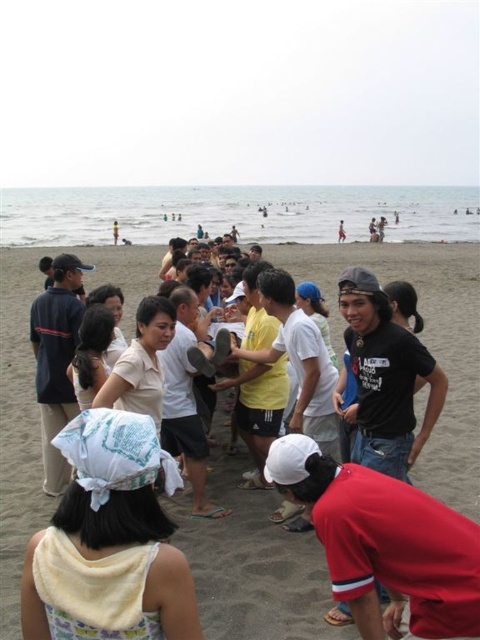
You are a photographer trying to capture a photo of the matte yellow towel at center without any obstructions. Given that the red matte baseball cap at lower center is in the scene, where should you position yourself relative to the towel to ensure the cap doesn t block your view?

To avoid the red matte baseball cap at lower center obstructing the view of the matte yellow towel at center, position yourself in front of the matte yellow towel at center since the cap is located behind it.